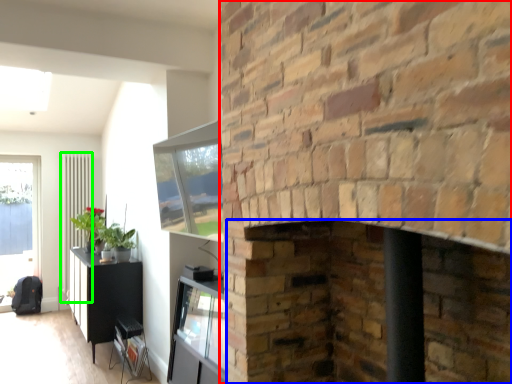
Question: Considering the real-world distances, which object is closest to fireplace (highlighted by a red box)? fireplace (highlighted by a blue box) or radiator (highlighted by a green box).

Choices:
 (A) fireplace
 (B) radiator

Answer: (A)